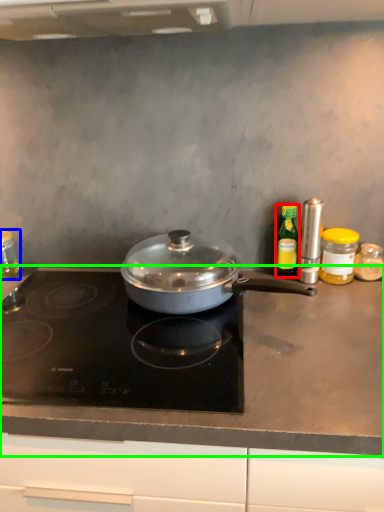
Question: Which object is positioned farthest from kitchen appliance (highlighted by a red box)? Select from kitchen appliance (highlighted by a blue box) and countertop (highlighted by a green box).

Choices:
 (A) kitchen appliance
 (B) countertop

Answer: (A)